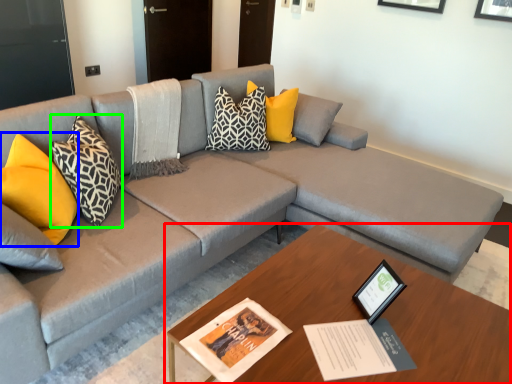
Question: Considering the real-world distances, which object is farthest from table (highlighted by a red box)? pillow (highlighted by a blue box) or pillow (highlighted by a green box)?

Choices:
 (A) pillow
 (B) pillow

Answer: (A)